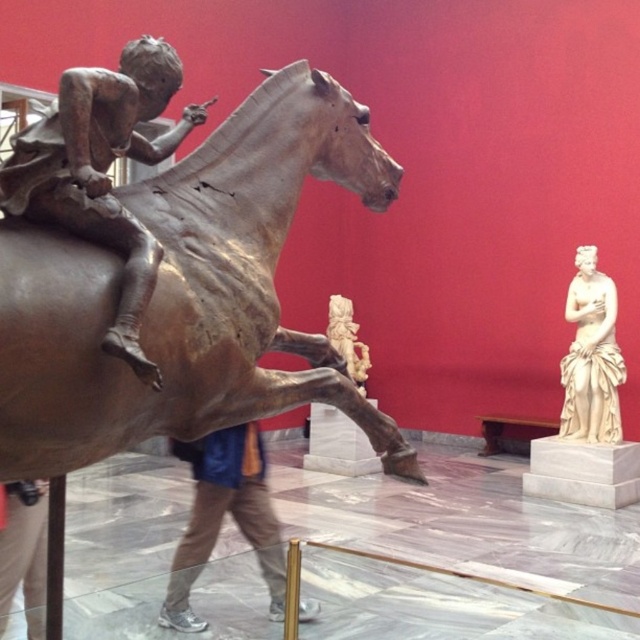
The image size is (640, 640). In order to click on bronze statue at left in this screenshot , I will do `click(102, 172)`.

Who is more distant from viewer, (58, 113) or (611, 365)?

The point (611, 365) is behind.

Find the location of `bronze statue at left`. bronze statue at left is located at coordinates (102, 172).

Is point (202, 552) farther from viewer compared to point (40, 522)?

Yes, point (202, 552) is behind point (40, 522).

Can you confirm if blue denim jeans at center is wider than brushed metal figure at lower left?

Yes, blue denim jeans at center is wider than brushed metal figure at lower left.

What are the coordinates of `blue denim jeans at center` in the screenshot? It's located at (221, 516).

Find the location of a particular element. blue denim jeans at center is located at coordinates (221, 516).

Which is more to the right, bronze metallic horse at center or golden polished statue at center?

Positioned to the right is golden polished statue at center.

Who is more forward, (49, 310) or (342, 346)?

Positioned in front is point (49, 310).

Where is `bronze metallic horse at center`? bronze metallic horse at center is located at coordinates (188, 292).